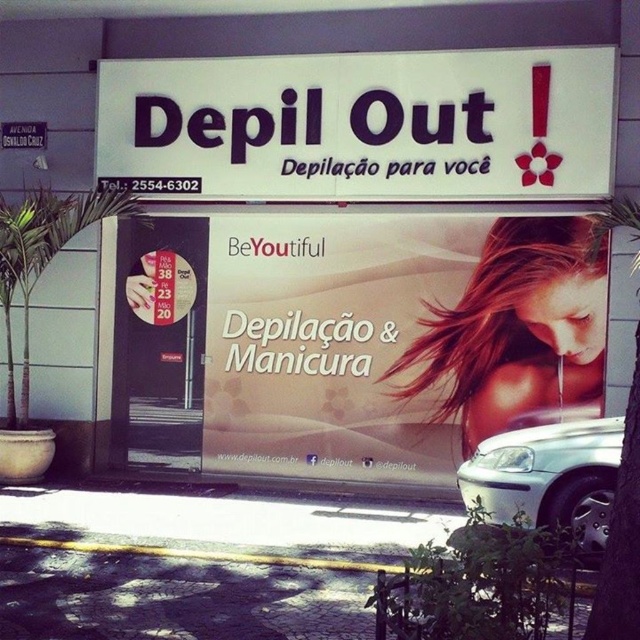
You are standing in front of the Depil Out! storefront and want to touch both points mentioned. Which point should you reach for first, the one at point (316,426) or the one at point (570,122)?

You should reach for point (570,122) first because it is closer to you than point (316,426), which is further away.

You are a customer looking to contact the business. You see the matte white banner at center and the white plastic sign at upper center. Which one has the phone number listed?

The white plastic sign at upper center has the phone number listed.

You are a customer arriving at the store and see the white plastic sign at upper center and the silver metallic car at lower right. Which object is closer to the entrance of the store?

The silver metallic car at lower right is closer to the entrance of the store because the white plastic sign at upper center is positioned on the right side of it, implying the car is in front.